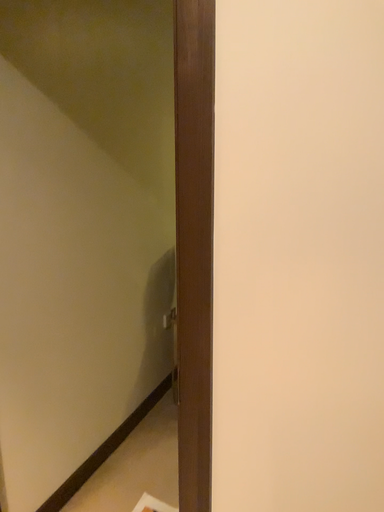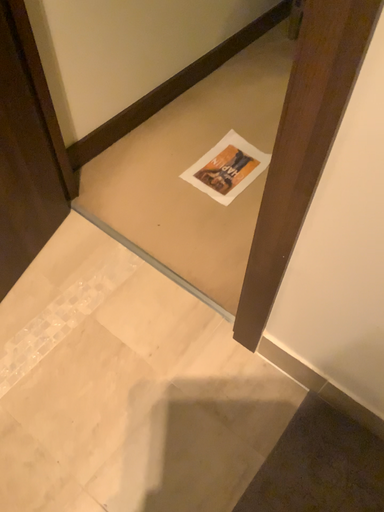
Question: How did the camera likely rotate when shooting the video?

Choices:
 (A) rotated left
 (B) rotated right

Answer: (A)